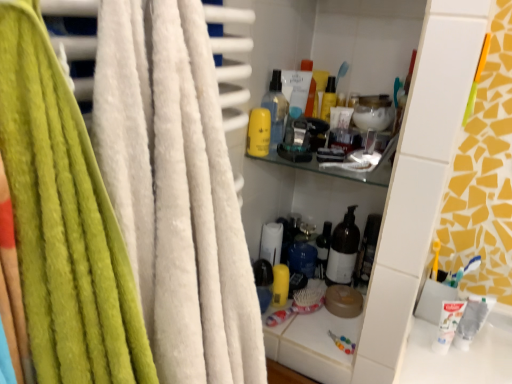
Question: Does yellow matte lotion at upper center have a greater width compared to translucent plastic spray bottle at upper center, which is counted as the first bottle, starting from the front?

Choices:
 (A) yes
 (B) no

Answer: (A)

Question: Could you tell me if yellow matte lotion at upper center is turned towards translucent plastic spray bottle at upper center, which is the second bottle from back to front?

Choices:
 (A) yes
 (B) no

Answer: (B)

Question: From the image's perspective, is yellow matte lotion at upper center under translucent plastic spray bottle at upper center, which is the second bottle from back to front?

Choices:
 (A) no
 (B) yes

Answer: (B)

Question: Are yellow matte lotion at upper center and translucent plastic spray bottle at upper center, which is counted as the first bottle, starting from the front, beside each other?

Choices:
 (A) yes
 (B) no

Answer: (A)

Question: From a real-world perspective, is yellow matte lotion at upper center on translucent plastic spray bottle at upper center, which ranks as the 1th bottle in left-to-right order?

Choices:
 (A) yes
 (B) no

Answer: (B)

Question: From their relative heights in the image, would you say translucent glass bottle at center, positioned as the second bottle in top-to-bottom order, is taller or shorter than translucent plastic spray bottle at upper center, acting as the 2th bottle starting from the bottom?

Choices:
 (A) tall
 (B) short

Answer: (A)

Question: From the image's perspective, relative to translucent plastic spray bottle at upper center, which is the second bottle from back to front, is translucent glass bottle at center, the second bottle from the left, above or below?

Choices:
 (A) below
 (B) above

Answer: (A)

Question: Considering the positions of translucent glass bottle at center, the 1th bottle ordered from the bottom, and translucent plastic spray bottle at upper center, acting as the 2th bottle starting from the bottom, in the image, is translucent glass bottle at center, the 1th bottle ordered from the bottom, bigger or smaller than translucent plastic spray bottle at upper center, acting as the 2th bottle starting from the bottom,?

Choices:
 (A) big
 (B) small

Answer: (B)

Question: Choose the correct answer: Is translucent glass bottle at center, the second bottle from the left, inside translucent plastic spray bottle at upper center, which ranks as the 1th bottle in left-to-right order, or outside it?

Choices:
 (A) outside
 (B) inside

Answer: (A)

Question: From their relative heights in the image, would you say blue plastic toothbrush at lower right is taller or shorter than white matte toothpaste at lower right?

Choices:
 (A) tall
 (B) short

Answer: (B)

Question: Is blue plastic toothbrush at lower right wider or thinner than white matte toothpaste at lower right?

Choices:
 (A) wide
 (B) thin

Answer: (B)

Question: Is blue plastic toothbrush at lower right inside or outside of white matte toothpaste at lower right?

Choices:
 (A) inside
 (B) outside

Answer: (B)

Question: Considering the positions of point (453, 281) and point (445, 299), is point (453, 281) closer or farther from the camera than point (445, 299)?

Choices:
 (A) farther
 (B) closer

Answer: (B)

Question: From a real-world perspective, relative to translucent glass bottle at center, the 1th bottle ordered from the bottom, is yellow matte lotion at upper center vertically above or below?

Choices:
 (A) above
 (B) below

Answer: (A)

Question: From the image's perspective, is yellow matte lotion at upper center above or below translucent glass bottle at center, marked as the first bottle in a back-to-front arrangement?

Choices:
 (A) above
 (B) below

Answer: (A)